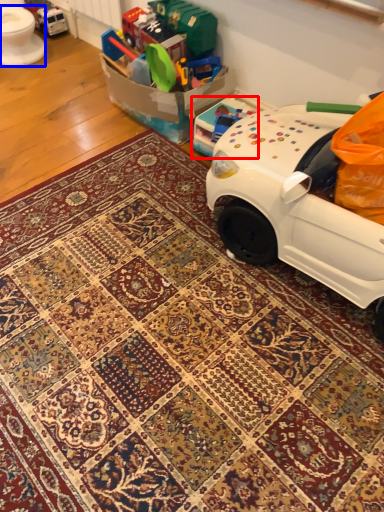
Question: Among these objects, which one is nearest to the camera, toy (highlighted by a red box) or toilet bowl (highlighted by a blue box)?

Choices:
 (A) toy
 (B) toilet bowl

Answer: (A)